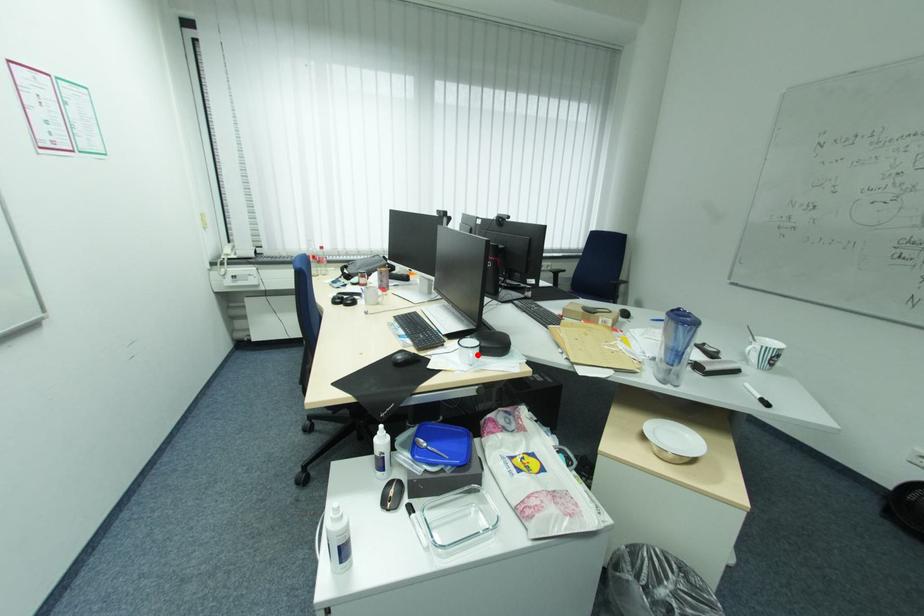
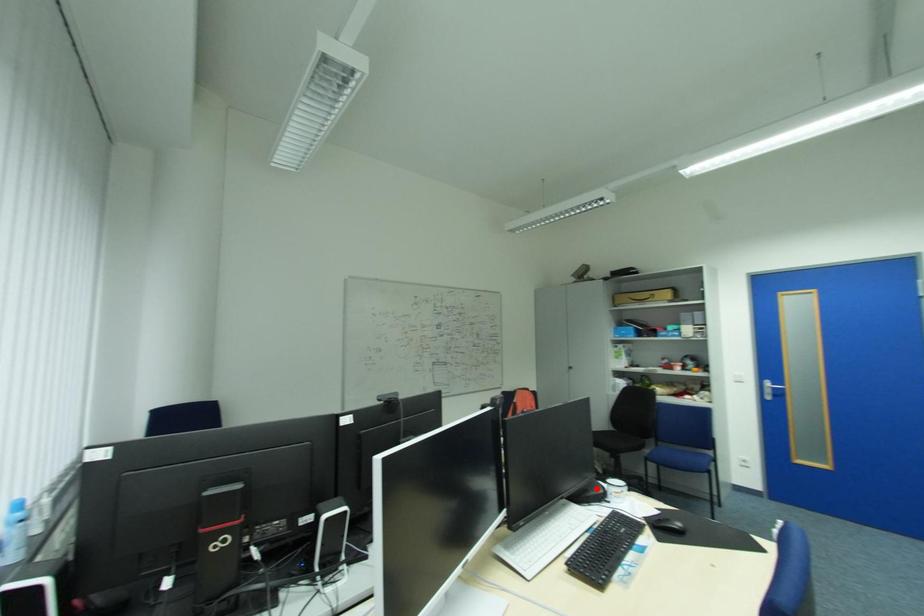
I am providing you with two images of the same scene from different viewpoints. A red point is marked on the first image and another point is marked on the second image. Do the highlighted points in image1 and image2 indicate the same real-world spot?

No